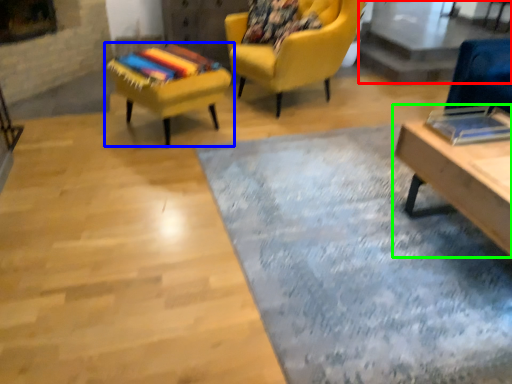
Question: Which object is positioned closest to glass table (highlighted by a red box)? Select from chair (highlighted by a blue box) and table (highlighted by a green box).

Choices:
 (A) chair
 (B) table

Answer: (B)